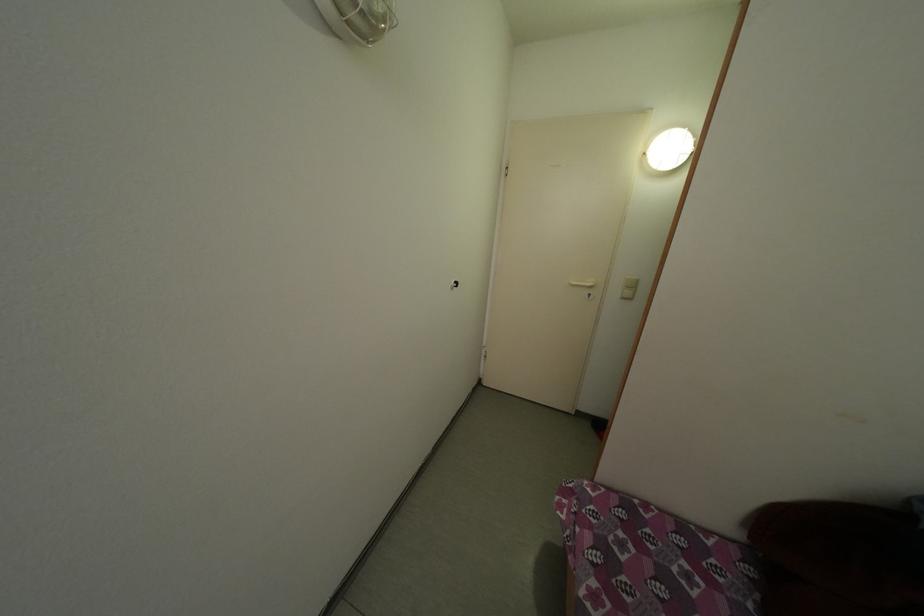
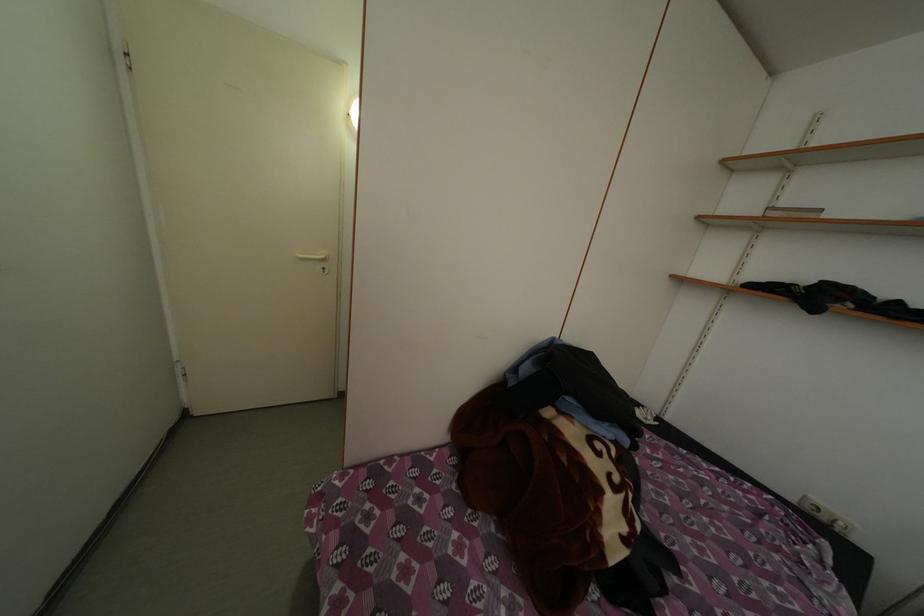
Question: The first image is from the beginning of the video and the second image is from the end. How did the camera likely rotate when shooting the video?

Choices:
 (A) Left
 (B) Right
 (C) Up
 (D) Down

Answer: (B)